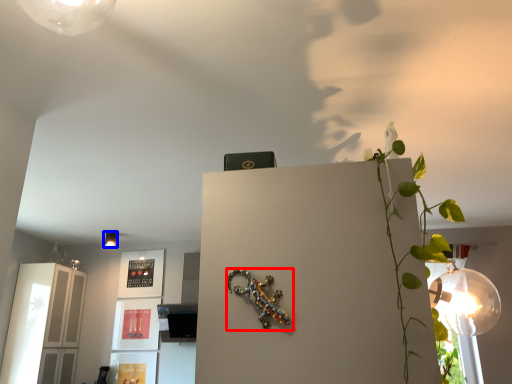
Question: Which object is further to the camera taking this photo, lizard (highlighted by a red box) or lamp (highlighted by a blue box)?

Choices:
 (A) lizard
 (B) lamp

Answer: (B)